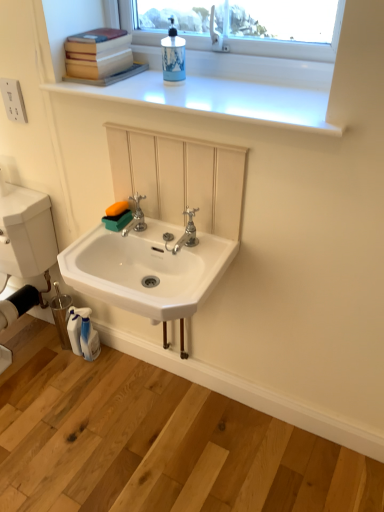
Measure the distance between white plastic electrical outlet at upper left and camera.

white plastic electrical outlet at upper left and camera are 1.46 meters apart.

What is the approximate width of hardcover books at upper left?

hardcover books at upper left is 10.69 inches wide.

The width and height of the screenshot is (384, 512). What do you see at coordinates (184, 233) in the screenshot? I see `polished chrome faucet at center, positioned as the 2th tap in left-to-right order` at bounding box center [184, 233].

I want to click on white glossy window sill at upper center, so click(218, 100).

Locate an element on the screen. This screenshot has width=384, height=512. blue ceramic soap dispenser at upper center is located at coordinates (173, 57).

Which object is more forward, polished chrome faucet at center, positioned as the 1th tap in right-to-left order, or white glossy window sill at upper center?

white glossy window sill at upper center.

How far apart are polished chrome faucet at center, positioned as the 1th tap in right-to-left order, and white glossy window sill at upper center?

16.22 inches.

Considering the relative sizes of polished chrome faucet at center, positioned as the 2th tap in left-to-right order, and white glossy window sill at upper center in the image provided, is polished chrome faucet at center, positioned as the 2th tap in left-to-right order, smaller than white glossy window sill at upper center?

Indeed, polished chrome faucet at center, positioned as the 2th tap in left-to-right order, has a smaller size compared to white glossy window sill at upper center.

Does point (197, 208) lie in front of point (319, 106)?

No, (197, 208) is behind (319, 106).

Between point (177, 38) and point (19, 346), which one is positioned in front?

Point (177, 38)

Is blue ceramic soap dispenser at upper center next to white glossy sink at lower center?

No.

Consider the image. From a real-world perspective, between blue ceramic soap dispenser at upper center and white glossy sink at lower center, who is vertically lower?

white glossy sink at lower center.

Looking at this image, choose the correct answer: Is blue ceramic soap dispenser at upper center inside white glossy sink at lower center or outside it?

blue ceramic soap dispenser at upper center cannot be found inside white glossy sink at lower center.

Who is taller, polished chrome faucet at center, positioned as the 1th tap in right-to-left order, or blue ceramic soap dispenser at upper center?

Standing taller between the two is blue ceramic soap dispenser at upper center.

Considering the relative sizes of polished chrome faucet at center, positioned as the 1th tap in right-to-left order, and blue ceramic soap dispenser at upper center in the image provided, is polished chrome faucet at center, positioned as the 1th tap in right-to-left order, wider than blue ceramic soap dispenser at upper center?

Indeed, polished chrome faucet at center, positioned as the 1th tap in right-to-left order, has a greater width compared to blue ceramic soap dispenser at upper center.

Choose the correct answer: Is polished chrome faucet at center, positioned as the 2th tap in left-to-right order, inside blue ceramic soap dispenser at upper center or outside it?

polished chrome faucet at center, positioned as the 2th tap in left-to-right order, is not enclosed by blue ceramic soap dispenser at upper center.

Considering their positions, is polished chrome faucet at center, positioned as the 2th tap in left-to-right order, located in front of or behind blue ceramic soap dispenser at upper center?

Visually, polished chrome faucet at center, positioned as the 2th tap in left-to-right order, is located behind blue ceramic soap dispenser at upper center.

Which is more to the right, white glossy sink at lower center or blue ceramic soap dispenser at upper center?

blue ceramic soap dispenser at upper center.

Does white glossy sink at lower center have a lesser height compared to blue ceramic soap dispenser at upper center?

Correct, white glossy sink at lower center is not as tall as blue ceramic soap dispenser at upper center.

From the picture: Which of these two, white glossy sink at lower center or blue ceramic soap dispenser at upper center, is wider?

white glossy sink at lower center is wider.

This screenshot has width=384, height=512. What are the coordinates of `counter in front of the blue ceramic soap dispenser at upper center` in the screenshot? It's located at (155, 441).

How many degrees apart are the facing directions of white glossy sink at center and white glossy window sill at upper center?

1.72 degrees.

Is white glossy sink at center next to white glossy window sill at upper center and touching it?

There is a gap between white glossy sink at center and white glossy window sill at upper center.

Is white glossy sink at center positioned in front of white glossy window sill at upper center?

No, white glossy sink at center is further to the viewer.

In the image, there is a white glossy window sill at upper center. Where is `sink below it (from a real-world perspective)`? This screenshot has height=512, width=384. sink below it (from a real-world perspective) is located at coordinates (147, 270).

Is white plastic electrical outlet at upper left with polished chrome faucet at center, positioned as the 2th tap in left-to-right order?

No, white plastic electrical outlet at upper left is not beside polished chrome faucet at center, positioned as the 2th tap in left-to-right order.

Is white plastic electrical outlet at upper left oriented away from polished chrome faucet at center, positioned as the 1th tap in right-to-left order?

white plastic electrical outlet at upper left is not turned away from polished chrome faucet at center, positioned as the 1th tap in right-to-left order.

Is white plastic electrical outlet at upper left bigger than polished chrome faucet at center, positioned as the 1th tap in right-to-left order?

Actually, white plastic electrical outlet at upper left might be smaller than polished chrome faucet at center, positioned as the 1th tap in right-to-left order.

Between white plastic electrical outlet at upper left and polished chrome faucet at center, positioned as the 2th tap in left-to-right order, which one has smaller width?

white plastic electrical outlet at upper left.

From a real-world perspective, which is physically above, white glossy window sill at upper center or silver metallic faucet at center, marked as the 1th tap in a left-to-right arrangement?

In real-world perspective, white glossy window sill at upper center is above.

Between white glossy window sill at upper center and silver metallic faucet at center, marked as the 1th tap in a left-to-right arrangement, which one is positioned behind?

silver metallic faucet at center, marked as the 1th tap in a left-to-right arrangement, is more distant.

From the picture: How much distance is there between white glossy window sill at upper center and silver metallic faucet at center, marked as the 1th tap in a left-to-right arrangement?

A distance of 45.42 centimeters exists between white glossy window sill at upper center and silver metallic faucet at center, marked as the 1th tap in a left-to-right arrangement.

Is the surface of white glossy window sill at upper center in direct contact with silver metallic faucet at center, the second tap from the right?

There is a gap between white glossy window sill at upper center and silver metallic faucet at center, the second tap from the right.

You are a GUI agent. You are given a task and a screenshot of the screen. Output one action in this format:
    pyautogui.click(x=<x>, y=<y>)
    Task: Click on the window sill that appears in front of the polished chrome faucet at center, positioned as the 1th tap in right-to-left order
    
    Given the screenshot: What is the action you would take?
    pyautogui.click(x=218, y=100)

Find the location of a particular element. counter that appears on the left of blue ceramic soap dispenser at upper center is located at coordinates (155, 441).

Estimate the real-world distances between objects in this image. Which object is closer to polished chrome faucet at center, positioned as the 1th tap in right-to-left order, white glossy window sill at upper center or white glossy sink at center?

white glossy sink at center is closer to polished chrome faucet at center, positioned as the 1th tap in right-to-left order.

Looking at the image, which one is located closer to white glossy window sill at upper center, silver metallic faucet at center, marked as the 1th tap in a left-to-right arrangement, or blue ceramic soap dispenser at upper center?

blue ceramic soap dispenser at upper center is closer to white glossy window sill at upper center.

Which object lies nearer to the anchor point white plastic electrical outlet at upper left, silver metallic faucet at center, marked as the 1th tap in a left-to-right arrangement, or blue ceramic soap dispenser at upper center?

silver metallic faucet at center, marked as the 1th tap in a left-to-right arrangement, lies closer to white plastic electrical outlet at upper left than the other object.

When comparing their distances from polished chrome faucet at center, positioned as the 2th tap in left-to-right order, does white glossy sink at lower center or white glossy sink at center seem further?

Based on the image, white glossy sink at lower center appears to be further to polished chrome faucet at center, positioned as the 2th tap in left-to-right order.

When comparing their distances from white plastic electrical outlet at upper left, does polished chrome faucet at center, positioned as the 1th tap in right-to-left order, or silver metallic faucet at center, the second tap from the right, seem closer?

silver metallic faucet at center, the second tap from the right, is closer to white plastic electrical outlet at upper left.

When comparing their distances from white glossy sink at lower center, does white glossy window sill at upper center or silver metallic faucet at center, the second tap from the right, seem further?

white glossy window sill at upper center.

From the image, which object appears to be farther from white glossy sink at center, blue ceramic soap dispenser at upper center or white glossy window sill at upper center?

blue ceramic soap dispenser at upper center lies further to white glossy sink at center than the other object.

Considering their positions, is blue ceramic soap dispenser at upper center positioned further to white glossy sink at lower center than hardcover books at upper left?

blue ceramic soap dispenser at upper center.

Identify the location of electric outlet that lies between hardcover books at upper left and polished chrome faucet at center, positioned as the 1th tap in right-to-left order, from top to bottom. Image resolution: width=384 pixels, height=512 pixels. (13, 100).

Locate an element on the screen. The width and height of the screenshot is (384, 512). window sill between blue ceramic soap dispenser at upper center and polished chrome faucet at center, positioned as the 2th tap in left-to-right order, in the up-down direction is located at coordinates (218, 100).

Identify the location of window sill between blue ceramic soap dispenser at upper center and white glossy sink at center in the vertical direction. This screenshot has width=384, height=512. click(218, 100).

The image size is (384, 512). Identify the location of electric outlet that lies between blue ceramic soap dispenser at upper center and white glossy sink at lower center from top to bottom. (13, 100).